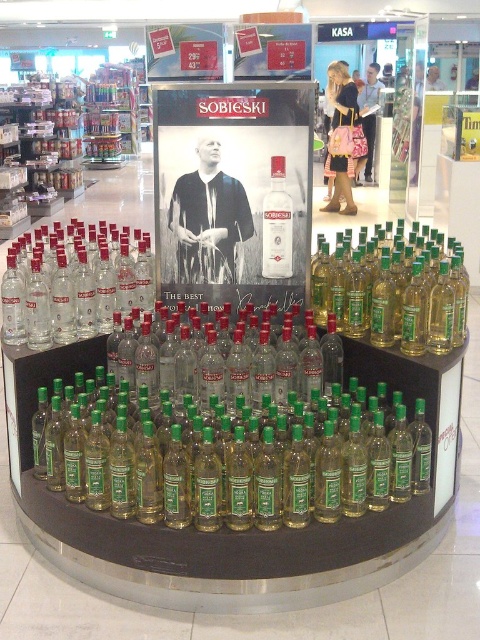
Is matte black poster at center taller than clear glass bottle at center?

Indeed, matte black poster at center has a greater height compared to clear glass bottle at center.

Who is more distant from viewer, (204,150) or (289,211)?

The point (289,211) is behind.

Identify the location of matte black poster at center. Image resolution: width=480 pixels, height=640 pixels. (232, 193).

Does matte black poster at center lie in front of transparent glass bottles at left?

Yes, matte black poster at center is in front of transparent glass bottles at left.

Can you confirm if matte black poster at center is positioned below transparent glass bottles at left?

No, matte black poster at center is not below transparent glass bottles at left.

Does point (232, 230) come closer to viewer compared to point (73, 323)?

Yes, point (232, 230) is closer to viewer.

The height and width of the screenshot is (640, 480). Identify the location of matte black poster at center. (232, 193).

Looking at this image, is matte black poster at center to the left of green glass bottle at right from the viewer's perspective?

Correct, you'll find matte black poster at center to the left of green glass bottle at right.

Who is higher up, matte black poster at center or green glass bottle at right?

matte black poster at center is above.

At what (x,y) coordinates should I click in order to perform the action: click on matte black poster at center. Please return your answer as a coordinate pair (x, y). The width and height of the screenshot is (480, 640). Looking at the image, I should click on (232, 193).

In order to click on matte black poster at center in this screenshot , I will do `click(232, 193)`.